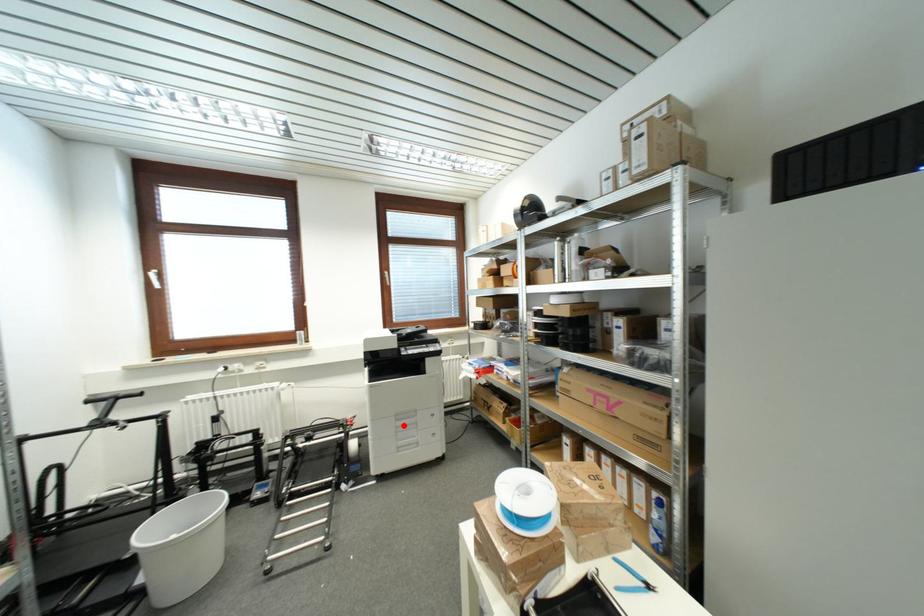
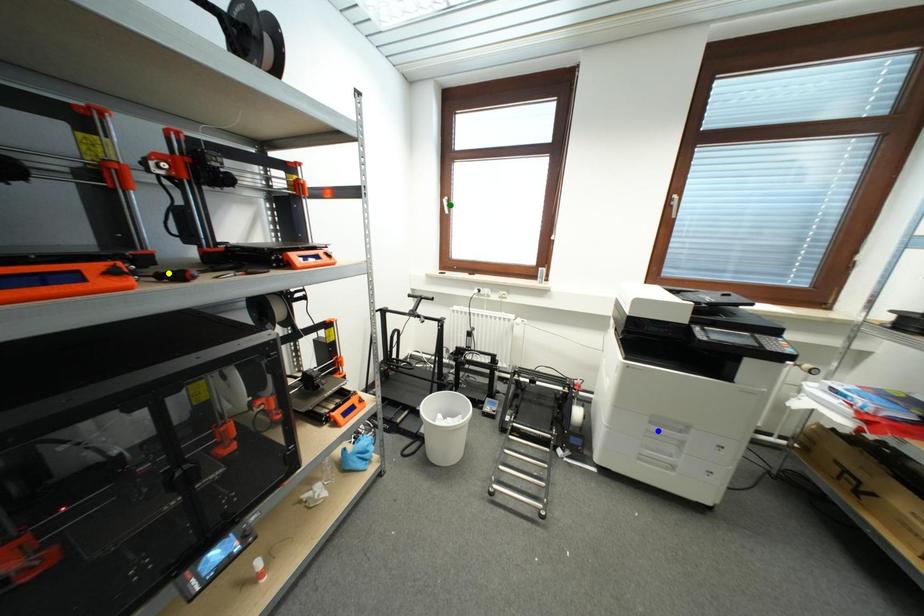
Question: I am providing you with two images of the same scene from different viewpoints. A red point is marked on the first image. You are given multiple points on the second image. Can you choose the point in image 2 that corresponds to the point in image 1?

Choices:
 (A) blue point
 (B) yellow point
 (C) green point

Answer: (A)